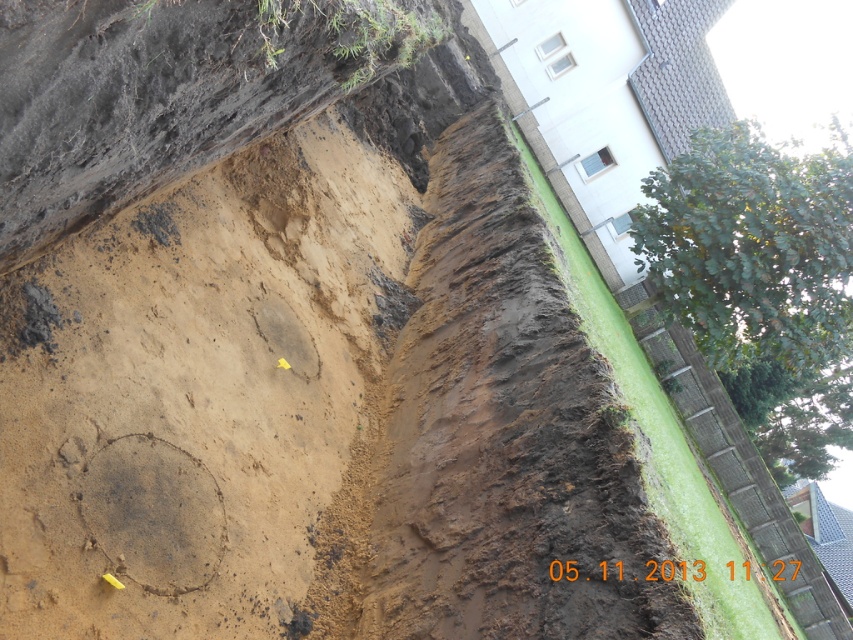
Based on the photo, can you confirm if brown sandy mud at center is wider than brown muddy soil at center?

Yes, brown sandy mud at center is wider than brown muddy soil at center.

Which is in front, point (115, 481) or point (451, 314)?

Positioned in front is point (115, 481).

Where is `brown sandy mud at center`? Image resolution: width=853 pixels, height=640 pixels. brown sandy mud at center is located at coordinates (196, 392).